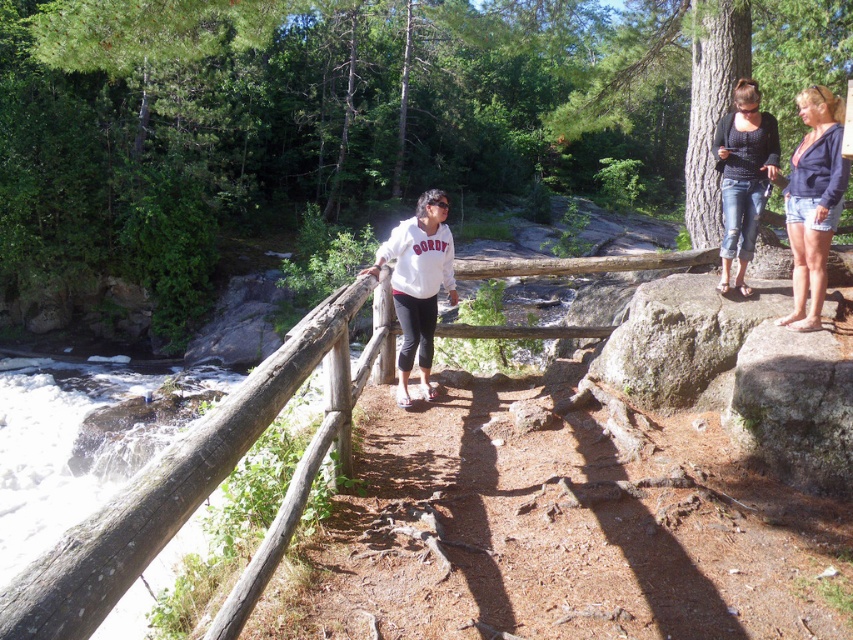
You are standing on the dirt pathway and see the denim shorts at upper right and the white matte sweatshirt at center. Which object is nearer to you?

The denim shorts at upper right is closer to the viewer than the white matte sweatshirt at center.

Based on the photo, you are standing on the dirt pathway and want to take a photo of both the white frothy water at lower left and the white matte sweatshirt at center. Which object should you focus on first to ensure both are in clear view?

You should focus on the white frothy water at lower left first because it is closer to you than the white matte sweatshirt at center, ensuring both objects are in focus.